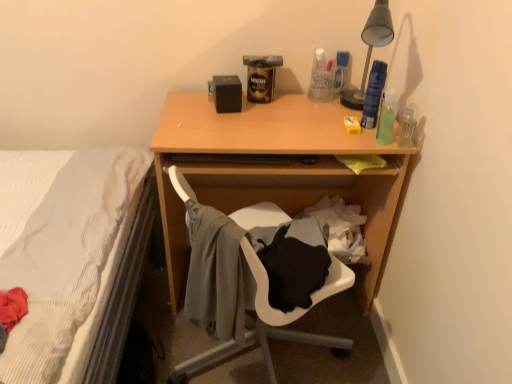
The height and width of the screenshot is (384, 512). Identify the location of vacant space that's between translucent plastic spray can at upper right, marked as the 3th bottle in a front-to-back arrangement, and clear plastic bottle at right, which is the 3th bottle in back-to-front order. (387, 130).